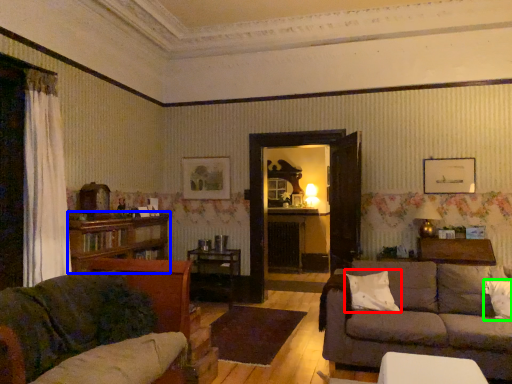
Question: Based on their relative distances, which object is nearer to pillow (highlighted by a red box)? Choose from bookcase (highlighted by a blue box) and pillow (highlighted by a green box).

Choices:
 (A) bookcase
 (B) pillow

Answer: (B)